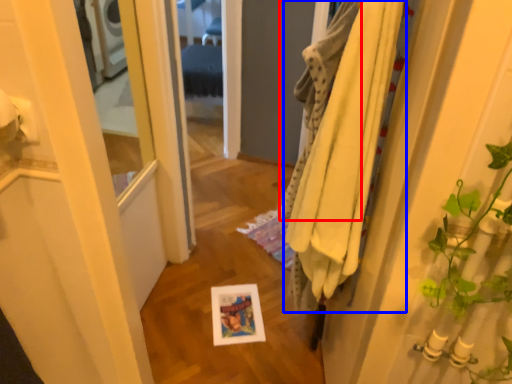
Question: Which of the following is the closest to the observer, bath towel (highlighted by a red box) or bath towel (highlighted by a blue box)?

Choices:
 (A) bath towel
 (B) bath towel

Answer: (B)